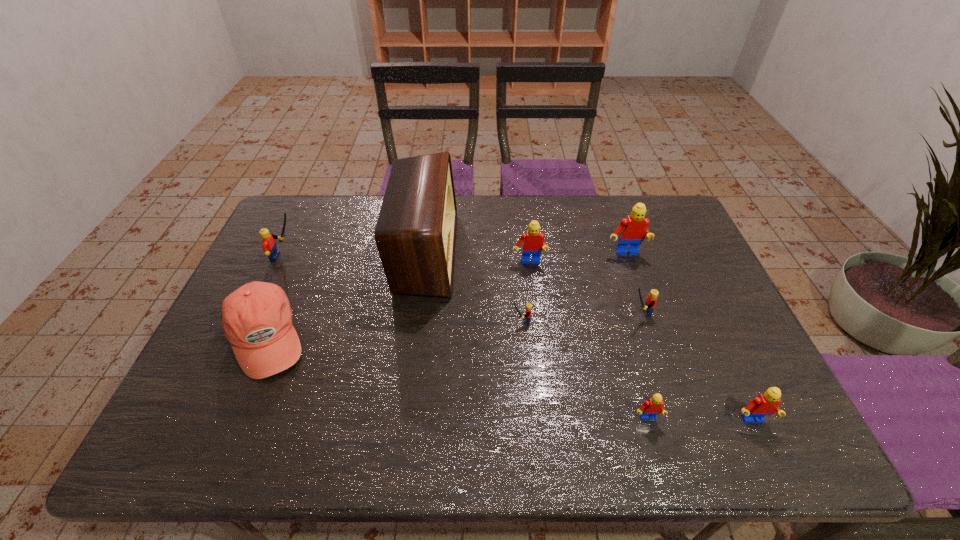
At what (x,y) coordinates should I click in order to perform the action: click on the rightmost object. Please return your answer as a coordinate pair (x, y). The width and height of the screenshot is (960, 540). Looking at the image, I should click on (766, 404).

At what (x,y) coordinates should I click in order to perform the action: click on the second yellow Lego from right to left. Please return your answer as a coordinate pair (x, y). This screenshot has width=960, height=540. Looking at the image, I should click on (528, 306).

You are a GUI agent. You are given a task and a screenshot of the screen. Output one action in this format:
    pyautogui.click(x=<x>, y=<y>)
    Task: Click on the smallest red Lego
    
    Given the screenshot: What is the action you would take?
    pyautogui.click(x=653, y=406)

Find the location of a particular element. Image resolution: width=960 pixels, height=540 pixels. free region located 0.160m on the front-facing side of the third object from left to right is located at coordinates (506, 252).

Find the location of `vacant area located on the front-facing side of the biggest red Lego`. vacant area located on the front-facing side of the biggest red Lego is located at coordinates (653, 335).

Where is `vacant space located 0.070m on the front-facing side of the biggest yellow Lego`? The image size is (960, 540). vacant space located 0.070m on the front-facing side of the biggest yellow Lego is located at coordinates (320, 256).

The height and width of the screenshot is (540, 960). I want to click on blank space located on the front-facing side of the leftmost red Lego, so click(537, 330).

Where is `free space located 0.370m on the back of the baseball cap`? free space located 0.370m on the back of the baseball cap is located at coordinates (315, 221).

I want to click on vacant space located on the front-facing side of the second smallest yellow Lego, so click(525, 312).

Where is `blank space located 0.350m on the front-facing side of the second smallest yellow Lego`? The width and height of the screenshot is (960, 540). blank space located 0.350m on the front-facing side of the second smallest yellow Lego is located at coordinates (499, 312).